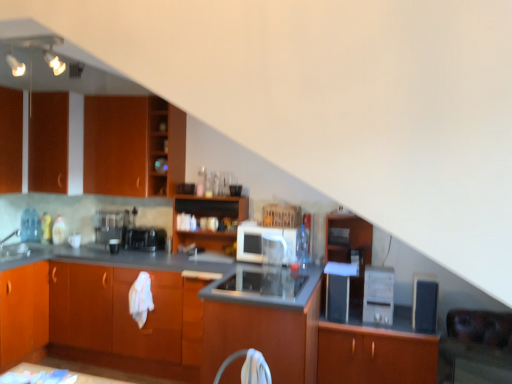
I want to click on vacant space in front of wooden cabinet at center, which appears as the 2th appliance when viewed from the right, so click(386, 329).